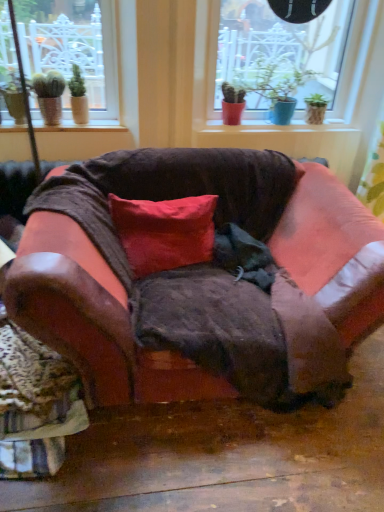
Question: Based on their positions, is matte brown pot at upper left located to the left or right of matte red pot at center?

Choices:
 (A) right
 (B) left

Answer: (B)

Question: Considering the positions of matte brown pot at upper left and matte red pot at center in the image, is matte brown pot at upper left taller or shorter than matte red pot at center?

Choices:
 (A) short
 (B) tall

Answer: (A)

Question: Based on their relative distances, which object is nearer to the red cotton pillow at center?

Choices:
 (A) smooth wood window sill at upper left, the 2th window sill from the right
 (B) leather-like fabric swivel chair at lower left
 (C) matte brown pot at upper left
 (D) leather couch at center
 (E) smooth ceramic pots at center, which appears as the 2th window sill when viewed from the front

Answer: (D)

Question: Which object is positioned farthest from the leather couch at center?

Choices:
 (A) red cotton pillow at center
 (B) smooth wood window sill at upper left, the 2th window sill from the right
 (C) matte red pot at center
 (D) smooth ceramic pots at center, which appears as the 2th window sill when viewed from the front
 (E) leather-like fabric swivel chair at lower left

Answer: (C)